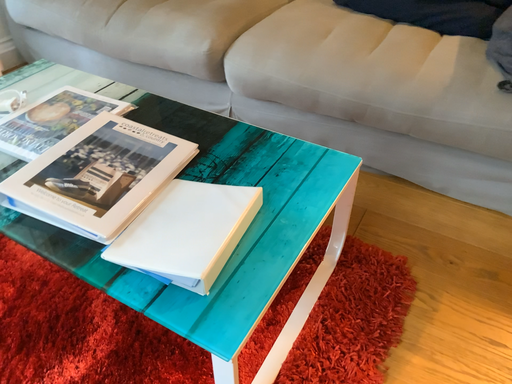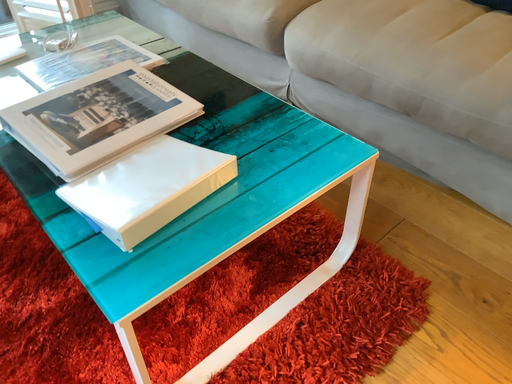
Question: How did the camera likely rotate when shooting the video?

Choices:
 (A) rotated left
 (B) rotated right

Answer: (A)